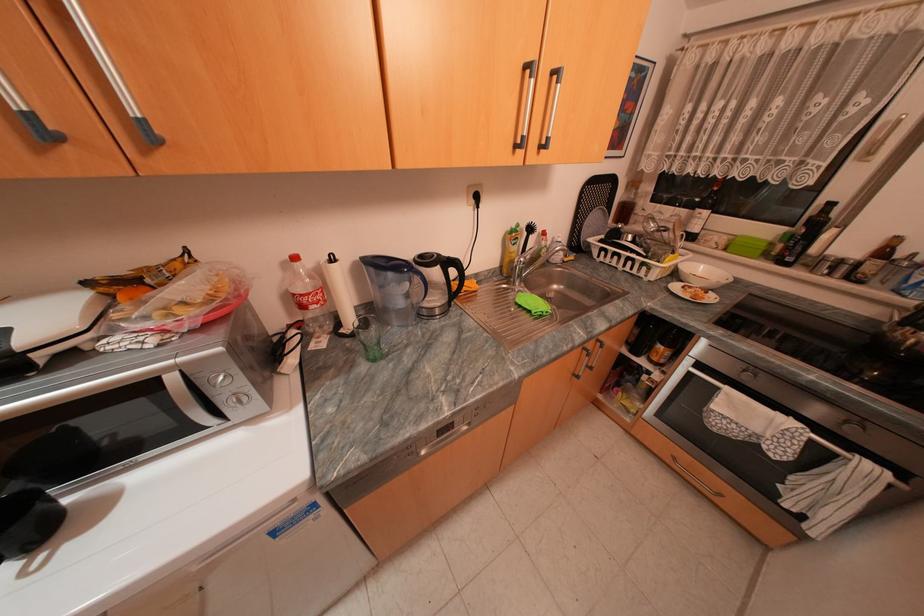
Where would you turn the kitchen faucet handle? Please return your answer as a coordinate pair (x, y).

(537, 259)